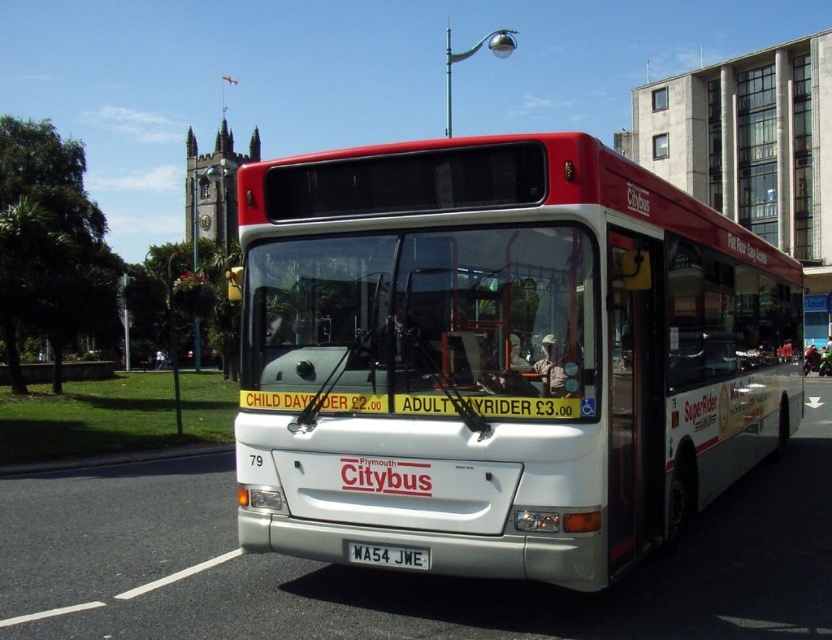
Question: Can you confirm if white matte bus at center is positioned to the right of white metallic license plate at center?

Choices:
 (A) yes
 (B) no

Answer: (A)

Question: Does white matte bus at center appear on the right side of white metallic license plate at center?

Choices:
 (A) no
 (B) yes

Answer: (B)

Question: Which of the following is the closest to the observer?

Choices:
 (A) white metallic license plate at center
 (B) white matte bus at center

Answer: (B)

Question: Can you confirm if white matte bus at center is bigger than white metallic license plate at center?

Choices:
 (A) yes
 (B) no

Answer: (A)

Question: Among these points, which one is farthest from the camera?

Choices:
 (A) (370, 564)
 (B) (543, 422)

Answer: (A)